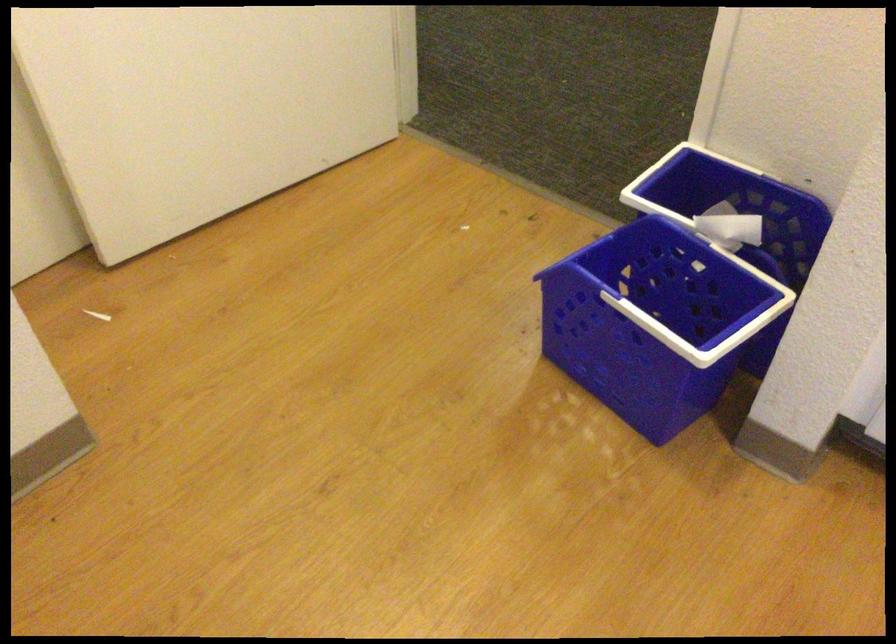
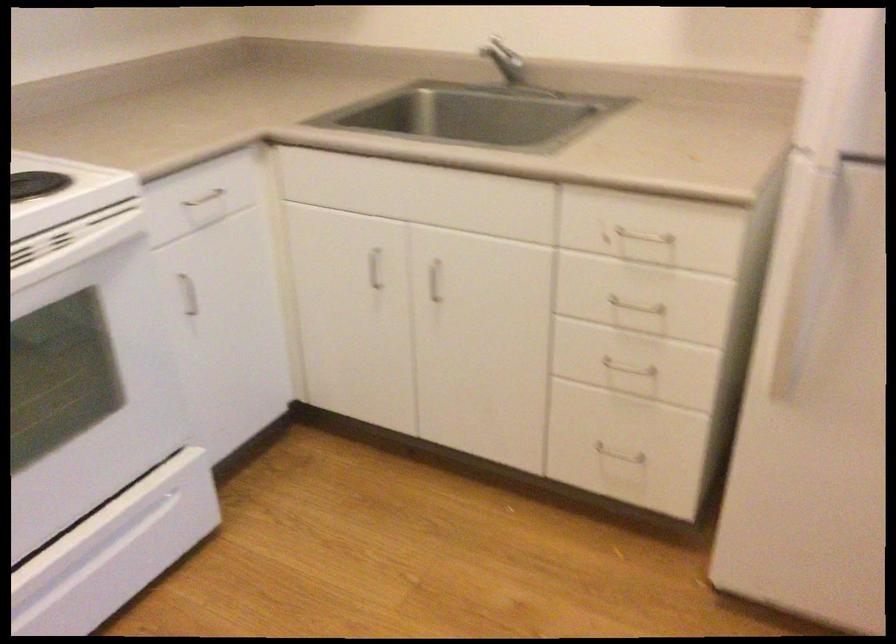
The images are taken continuously from a first-person perspective. In which direction is your viewpoint rotating?

The camera's rotation is toward right-down.